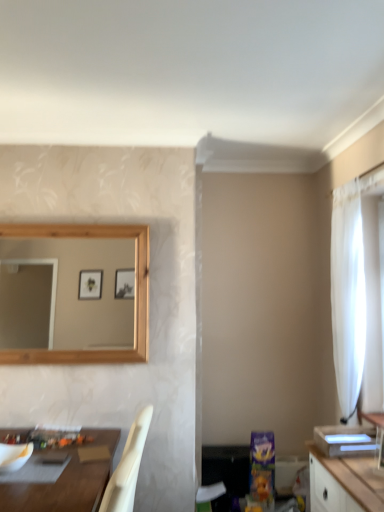
Locate an element on the screen. The height and width of the screenshot is (512, 384). free space above brown wooden table at lower left (from a real-world perspective) is located at coordinates (55, 465).